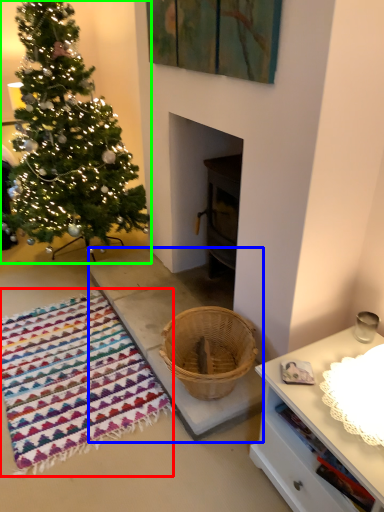
Question: Based on their relative distances, which object is farther from blanket (highlighted by a red box)? Choose from concrete (highlighted by a blue box) and christmas tree (highlighted by a green box).

Choices:
 (A) concrete
 (B) christmas tree

Answer: (B)